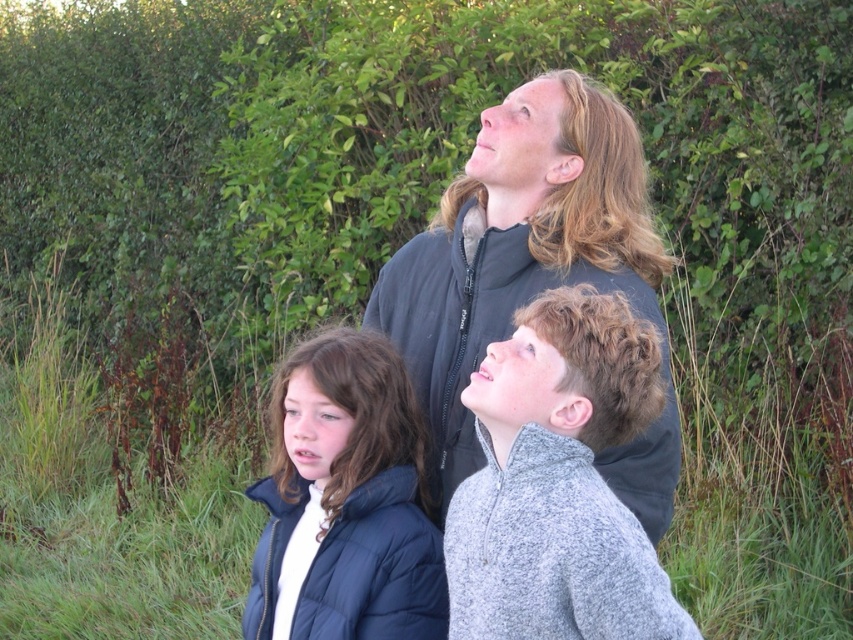
You are a photographer trying to capture a group photo of the dark gray jacket at center and the gray fleece jacket at center. Since you want to ensure both are in focus, you need to know which one is taller. Can you determine which is taller?

The dark gray jacket at center is taller than the gray fleece jacket at center, so you should adjust your camera settings to focus on the taller dark gray jacket at center first.

You are a photographer trying to capture a clear photo of the birds flying above the three people. You notice two jackets at the center of the scene. Which jacket, the dark gray jacket at center or the gray fleece jacket at center, is blocking the view more towards the birds?

The gray fleece jacket at center is behind the dark gray jacket at center, so the dark gray jacket at center is blocking the view more towards the birds.

You are trying to locate two jackets in the image. The dark gray jacket at center and the gray fleece jacket at center. Which one is positioned to the left?

The gray fleece jacket at center is positioned to the left of the dark gray jacket at center.